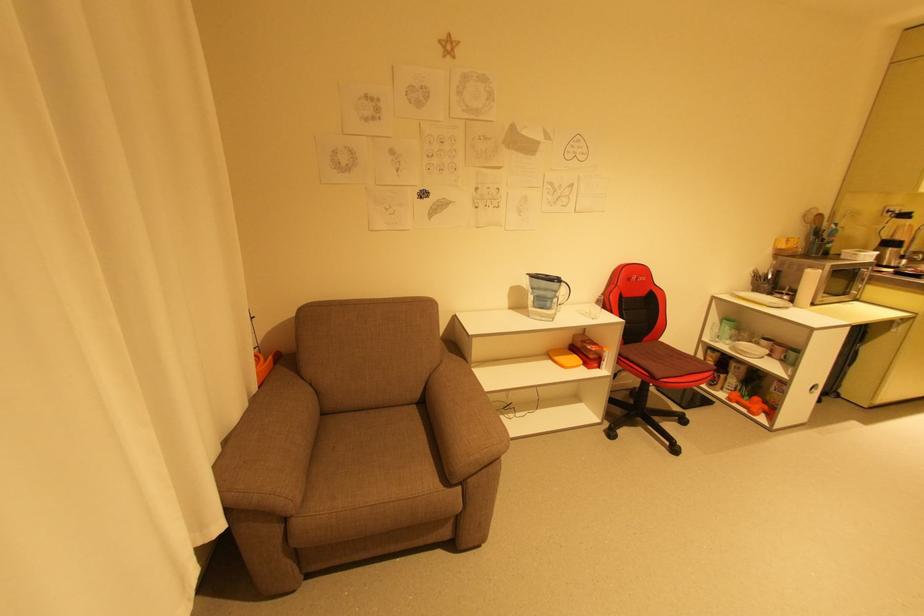
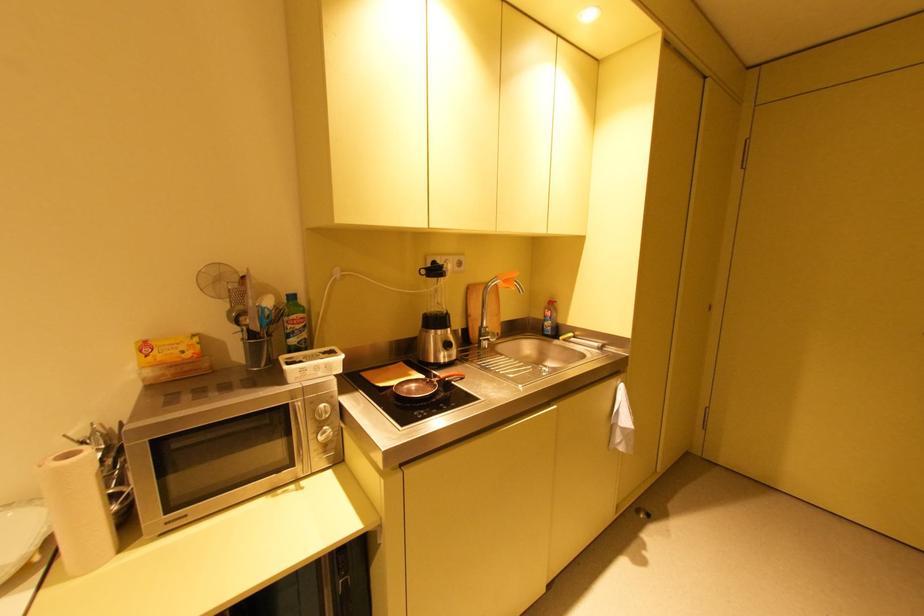
The images are taken continuously from a first-person perspective. In which direction are you moving?

The movement direction of the cameraman is right, forward.